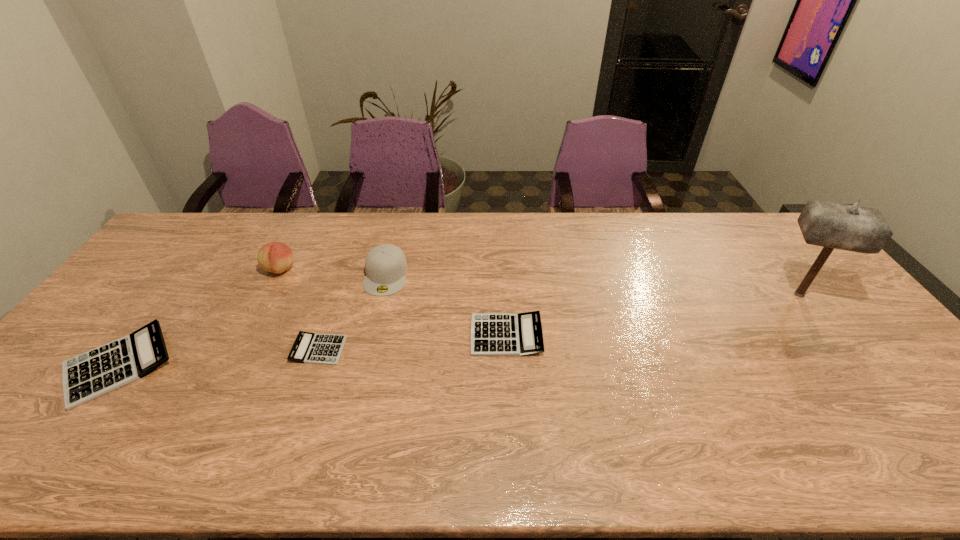
At what (x,y) coordinates should I click in order to perform the action: click on vacant region at the near edge of the desktop. Please return your answer as a coordinate pair (x, y). Looking at the image, I should click on (230, 423).

The height and width of the screenshot is (540, 960). Identify the location of vacant region at the left edge of the desktop. (116, 318).

What are the coordinates of `vacant area at the right edge` in the screenshot? It's located at (804, 264).

This screenshot has width=960, height=540. Identify the location of free location at the far right corner of the desktop. (774, 244).

Where is `vacant space in between the tallest object and the third object from right to left`? vacant space in between the tallest object and the third object from right to left is located at coordinates (592, 285).

The image size is (960, 540). Find the location of `free space between the second object from left to right and the second calculator from right to left`. free space between the second object from left to right and the second calculator from right to left is located at coordinates (300, 309).

Image resolution: width=960 pixels, height=540 pixels. What are the coordinates of `blank region between the rightmost object and the peach` in the screenshot? It's located at (x=540, y=281).

Where is `empty space between the tallest object and the second tallest calculator`? The width and height of the screenshot is (960, 540). empty space between the tallest object and the second tallest calculator is located at coordinates (653, 314).

This screenshot has width=960, height=540. I want to click on vacant area that lies between the leftmost object and the cap, so click(252, 320).

Find the location of a particular element. The image size is (960, 540). free point between the fourth object from right to left and the rightmost calculator is located at coordinates (x=413, y=342).